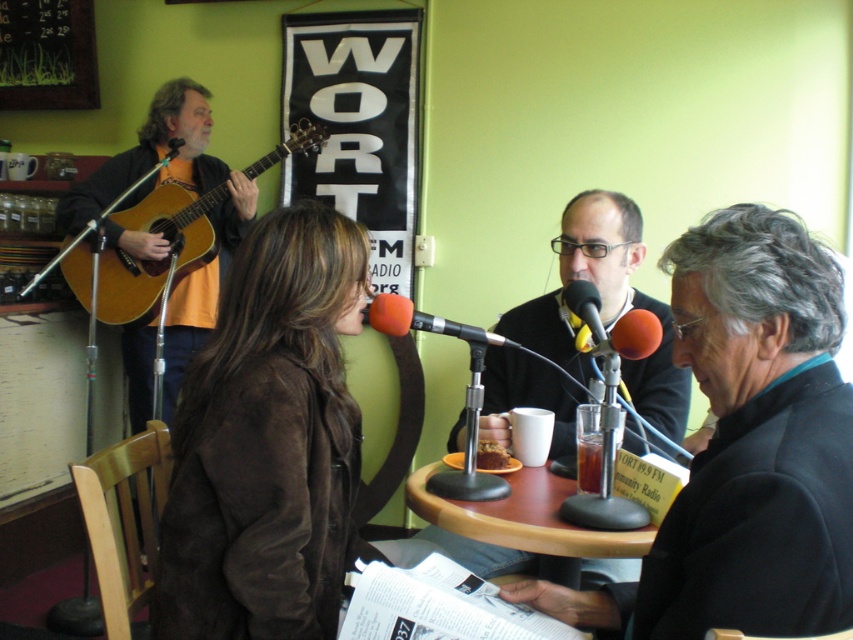
You are a guest on the radio show and need to place your water bottle on the table. The bottle is 3 inches in diameter. Can you place it between the brown suede jacket at center and the translucent glass at table center without touching either?

The distance between the brown suede jacket at center and the translucent glass at table center is 20.83 inches. Since the water bottle is only 3 inches in diameter, there is enough space to place it between them without touching either object.

You are a guest speaker at the radio station and need to place your notes on the nearest object. Which object is closer to you between the brushed metal bulletin board at upper left and the orange foam microphone at center?

The brushed metal bulletin board at upper left is closer to you because it is further to the viewer than the orange foam microphone at center, meaning it is positioned nearer in the scene.

You are an interior designer planning to hang a new picture frame between the brushed metal bulletin board at upper left and the orange foam microphone at center. Since the bulletin board is taller, where should you place the frame to maintain visual balance?

To maintain visual balance between the brushed metal bulletin board at upper left and the orange foam microphone at center, place the picture frame closer to the orange foam microphone at center since the bulletin board is taller and thus has more visual weight.